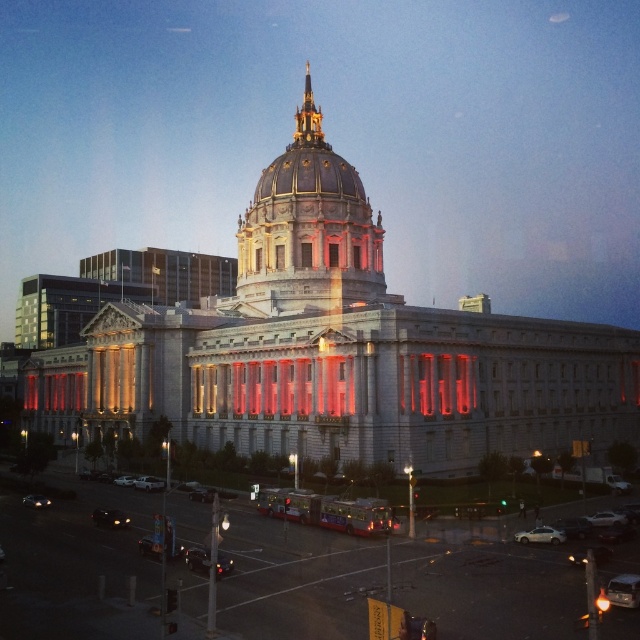
You are standing at the entrance of the grand neoclassical building and want to take a photo of the two points mentioned. Which point, point [97,524] or point [36,499], is closer to the building?

Point [36,499] is closer to the building because it is behind point [97,524], which is in front of it.

You are standing at the entrance of the grand neoclassical building and want to hail a taxi. The silver metallic car at lower right is the only vehicle available. Is it positioned in a place where you can easily access it from your current position?

The silver metallic car at lower right is located at point [540,536], which is relatively close to the entrance of the grand neoclassical building. Therefore, you can easily access it from your current position.

You are standing at the entrance of the grand neoclassical building and want to hail a taxi. There is a shiny black sedan at center. Where should you go to catch it?

The shiny black sedan at center is located at point (196,557). Since you are at the entrance of the grand neoclassical building, you should go towards the center area of the building to catch the shiny black sedan at center.